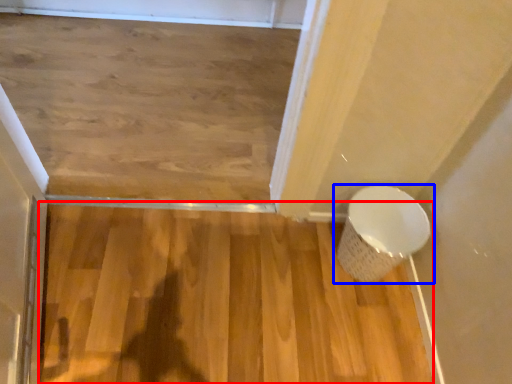
Question: Which point is closer to the camera, hardwood (highlighted by a red box) or toilet (highlighted by a blue box)?

Choices:
 (A) hardwood
 (B) toilet

Answer: (A)